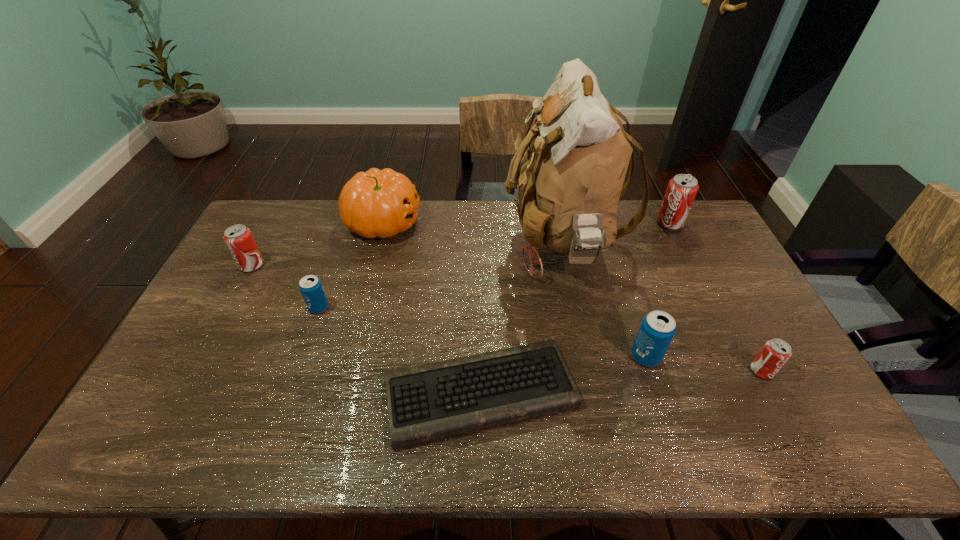
The image size is (960, 540). Identify the location of the smaller blue soda can. (310, 286).

What are the coordinates of `the third farthest soda can` in the screenshot? It's located at (310, 286).

Where is `computer keyboard`? computer keyboard is located at coordinates (435, 401).

You are a GUI agent. You are given a task and a screenshot of the screen. Output one action in this format:
    pyautogui.click(x=<x>, y=<y>)
    Task: Click on the vacant space situated 0.270m on the front-facing side of the tallest object
    Image resolution: width=960 pixels, height=540 pixels.
    Given the screenshot: What is the action you would take?
    pyautogui.click(x=425, y=245)

Find the location of `free location located on the front-facing side of the tallest object`. free location located on the front-facing side of the tallest object is located at coordinates (394, 245).

Find the location of `vacant space located on the front-facing side of the tallest object`. vacant space located on the front-facing side of the tallest object is located at coordinates (477, 245).

Locate an element on the screen. The height and width of the screenshot is (540, 960). vacant region located 0.250m on the carved face of the pumpkin is located at coordinates (490, 222).

At what (x,y) coordinates should I click in order to perform the action: click on free space located 0.280m on the front of the tallest soda can. Please return your answer as a coordinate pair (x, y). The image size is (960, 540). Looking at the image, I should click on (702, 288).

Find the location of a particular element. This screenshot has height=540, width=960. free space located 0.360m on the right of the leftmost object is located at coordinates (372, 265).

Image resolution: width=960 pixels, height=540 pixels. Identify the location of free space located on the left of the nearer blue soda can. (543, 356).